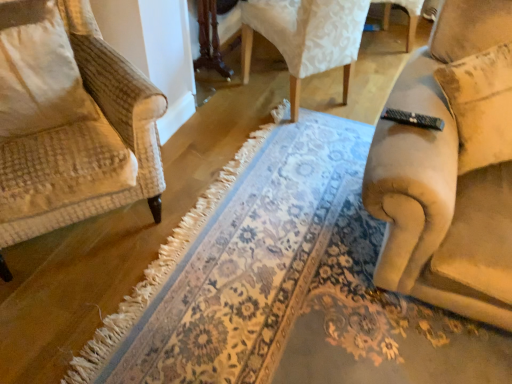
Question: Considering the relative positions of floral carpet at center and beige textured pillow at left in the image provided, is floral carpet at center behind beige textured pillow at left?

Choices:
 (A) yes
 (B) no

Answer: (B)

Question: Can you confirm if floral carpet at center is shorter than beige textured pillow at left?

Choices:
 (A) yes
 (B) no

Answer: (A)

Question: From the image's perspective, is floral carpet at center under beige textured pillow at left?

Choices:
 (A) no
 (B) yes

Answer: (B)

Question: From a real-world perspective, is floral carpet at center below beige textured pillow at left?

Choices:
 (A) no
 (B) yes

Answer: (B)

Question: Is floral carpet at center touching beige textured pillow at left?

Choices:
 (A) yes
 (B) no

Answer: (B)

Question: Considering the relative sizes of floral carpet at center and beige textured pillow at left in the image provided, is floral carpet at center thinner than beige textured pillow at left?

Choices:
 (A) no
 (B) yes

Answer: (A)

Question: Is beige textured pillow at left surrounded by beige fabric couch at right, arranged as the first chair when viewed from the front?

Choices:
 (A) no
 (B) yes

Answer: (A)

Question: Is beige fabric couch at right, the second chair in the back-to-front sequence, far away from beige textured pillow at left?

Choices:
 (A) no
 (B) yes

Answer: (B)

Question: Is beige fabric couch at right, the second chair in the back-to-front sequence, directly adjacent to beige textured pillow at left?

Choices:
 (A) no
 (B) yes

Answer: (A)

Question: Considering the relative positions of beige fabric couch at right, arranged as the first chair when viewed from the front, and beige textured pillow at left in the image provided, is beige fabric couch at right, arranged as the first chair when viewed from the front, to the right of beige textured pillow at left from the viewer's perspective?

Choices:
 (A) yes
 (B) no

Answer: (A)

Question: From a real-world perspective, is beige fabric couch at right, the second chair in the back-to-front sequence, over beige textured pillow at left?

Choices:
 (A) yes
 (B) no

Answer: (A)

Question: Is beige fabric couch at right, the second chair in the back-to-front sequence, positioned before beige textured pillow at left?

Choices:
 (A) no
 (B) yes

Answer: (B)

Question: Is beige textured pillow at left in front of floral carpet at center?

Choices:
 (A) yes
 (B) no

Answer: (B)